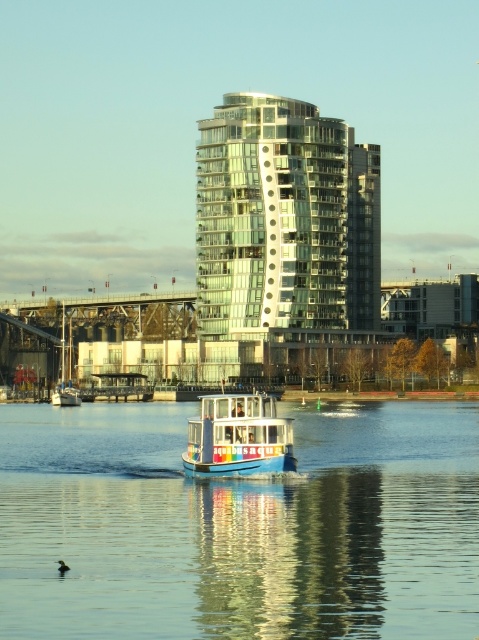
You are a tour guide explaining the landmarks in this area to visitors. You mention the glassy reflective building at center and the white glossy sailboat at left. How far apart are these two landmarks?

The glassy reflective building at center and the white glossy sailboat at left are 35.19 meters apart.

You are a drone operator trying to capture the glassy reflective building at center from above. The drone must stay within a 100m radius of the building to ensure stable transmission. Given that the building is at coordinates point 0.358, 0.597, can you confirm if the drone is within the required radius?

The glassy reflective building at center is located at point [285,228], so the drone must stay within 100m radius to maintain stable transmission. Since the question does not provide the drone coordinates, it cannot be determined if it is within the radius. Please provide the drone coordinates for accurate assessment.